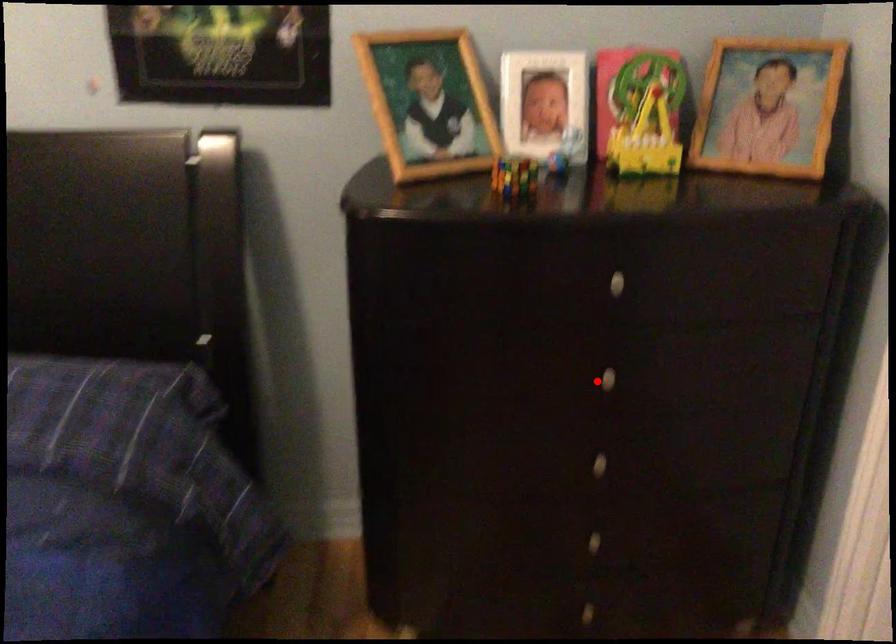
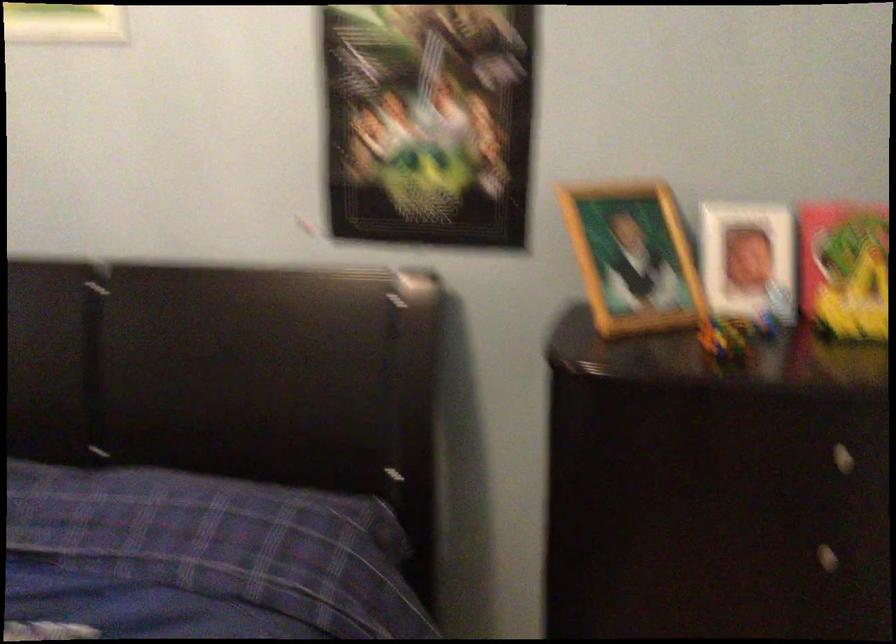
The point at the highlighted location is marked in the first image. Where is the corresponding point in the second image?

(807, 554)